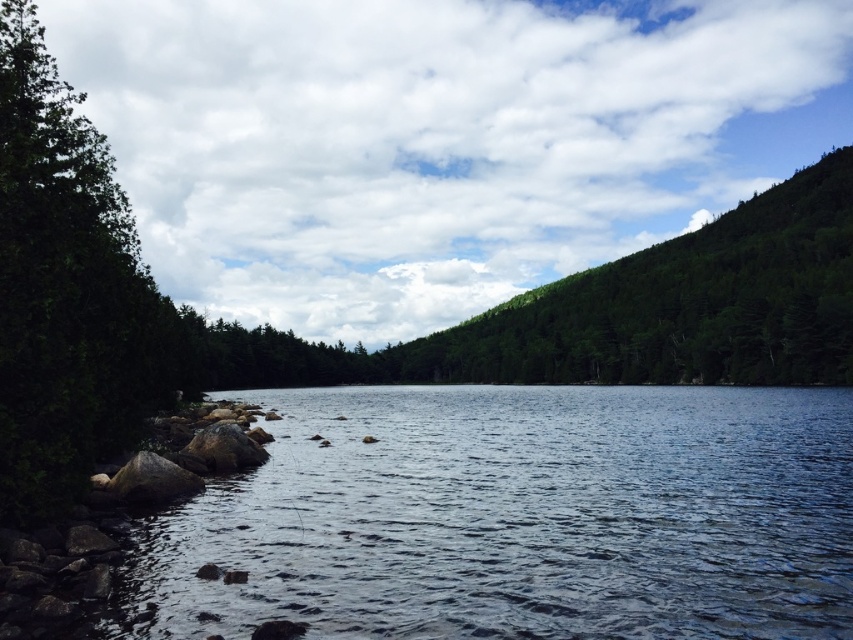
You are standing on the rocky shoreline and want to take a photo of the dark blue water at lower left and the green leafy tree at left. Which object will appear smaller in your photo?

The dark blue water at lower left will appear smaller in the photo because it has a lesser height compared to the green leafy tree at left.